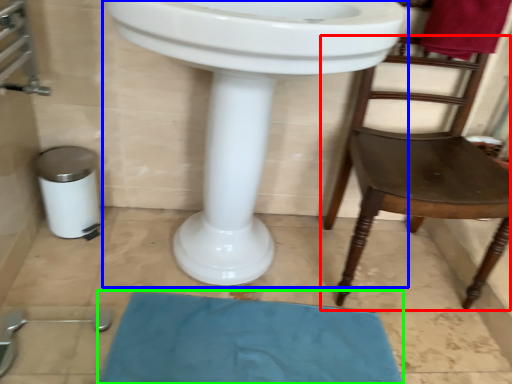
Question: Which is nearer to the chair (highlighted by a red box)? sink (highlighted by a blue box) or bath mat (highlighted by a green box).

Choices:
 (A) sink
 (B) bath mat

Answer: (A)